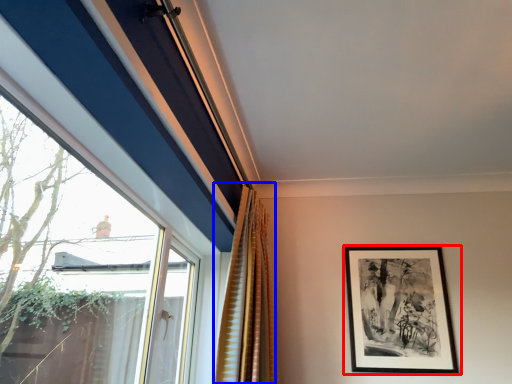
Question: Which object appears closest to the camera in this image, picture frame (highlighted by a red box) or curtain (highlighted by a blue box)?

Choices:
 (A) picture frame
 (B) curtain

Answer: (B)